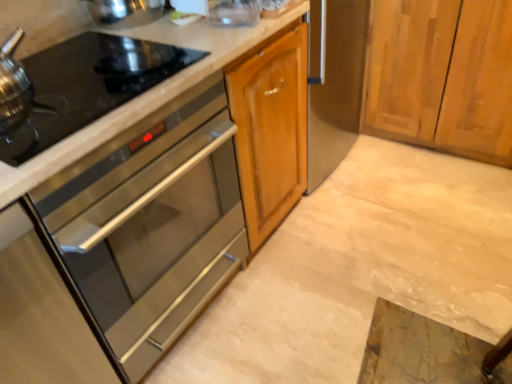
Describe the element at coordinates (131, 217) in the screenshot. This screenshot has height=384, width=512. I see `stainless steel oven at left` at that location.

What do you see at coordinates (360, 270) in the screenshot? I see `marble countertop at center` at bounding box center [360, 270].

You are a GUI agent. You are given a task and a screenshot of the screen. Output one action in this format:
    pyautogui.click(x=<x>, y=<y>)
    Task: Click on the stainless steel oven at left
    
    Given the screenshot: What is the action you would take?
    pyautogui.click(x=131, y=217)

Which is closer to the camera, [439,250] or [81,62]?

Positioned in front is point [81,62].

Considering the relative sizes of marble countertop at center and black glass gas stove at left in the image provided, is marble countertop at center shorter than black glass gas stove at left?

Correct, marble countertop at center is not as tall as black glass gas stove at left.

Is black glass gas stove at left at the back of marble countertop at center?

No, marble countertop at center is not facing the opposite direction of black glass gas stove at left.

Considering the positions of objects marble countertop at center and black glass gas stove at left in the image provided, who is more to the left, marble countertop at center or black glass gas stove at left?

black glass gas stove at left.

Consider the image. Is stainless steel oven at left oriented towards black glass gas stove at left?

No, stainless steel oven at left is not facing towards black glass gas stove at left.

From their relative heights in the image, would you say stainless steel oven at left is taller or shorter than black glass gas stove at left?

In the image, stainless steel oven at left appears to be taller than black glass gas stove at left.

At what (x,y) coordinates should I click in order to perform the action: click on gas stove that is on the left side of stainless steel oven at left. Please return your answer as a coordinate pair (x, y). Looking at the image, I should click on (85, 86).

Is stainless steel oven at left outside of black glass gas stove at left?

Yes.

From a real-world perspective, does stainless steel oven at left stand above marble countertop at center?

Yes, from a real-world perspective, stainless steel oven at left is on top of marble countertop at center.

From the image's perspective, is stainless steel oven at left over marble countertop at center?

Correct, stainless steel oven at left appears higher than marble countertop at center in the image.

Based on their positions, is stainless steel oven at left located to the left or right of marble countertop at center?

Based on their positions, stainless steel oven at left is located to the left of marble countertop at center.

Is stainless steel oven at left wider or thinner than marble countertop at center?

stainless steel oven at left is thinner than marble countertop at center.

Are marble countertop at center and stainless steel oven at left located far from each other?

That's not correct — marble countertop at center is a little close to stainless steel oven at left.

From the picture: From the image's perspective, is marble countertop at center above stainless steel oven at left?

No, from the image's perspective, marble countertop at center is not on top of stainless steel oven at left.

Consider the image. Could you tell me if marble countertop at center is turned towards stainless steel oven at left?

No, marble countertop at center is not turned towards stainless steel oven at left.

Between point (347, 331) and point (127, 113), which one is positioned in front?

The point (127, 113) is closer to the camera.

Considering the positions of points (55, 68) and (298, 6), is point (55, 68) farther from camera compared to point (298, 6)?

No, (55, 68) is closer to viewer.

Consider the image. In terms of width, does black glass gas stove at left look wider or thinner when compared to stainless steel oven at left?

Considering their sizes, black glass gas stove at left looks slimmer than stainless steel oven at left.

Does black glass gas stove at left appear on the right side of stainless steel oven at left?

No, black glass gas stove at left is not to the right of stainless steel oven at left.

Based on the photo, from a real-world perspective, is black glass gas stove at left over stainless steel oven at left?

Indeed, from a real-world perspective, black glass gas stove at left stands above stainless steel oven at left.

Is black glass gas stove at left touching marble countertop at center?

No.

Could you tell me if black glass gas stove at left is facing marble countertop at center?

No, black glass gas stove at left does not turn towards marble countertop at center.

From a real-world perspective, who is located higher, black glass gas stove at left or marble countertop at center?

black glass gas stove at left is physically above.

At what (x,y) coordinates should I click in order to perform the action: click on gas stove above the marble countertop at center (from the image's perspective). Please return your answer as a coordinate pair (x, y). The image size is (512, 384). Looking at the image, I should click on [x=85, y=86].

Locate an element on the screen. This screenshot has width=512, height=384. gas stove to the left of marble countertop at center is located at coordinates (85, 86).

Find the location of `cabinetry beneath the black glass gas stove at left (from a real-world perspective)`. cabinetry beneath the black glass gas stove at left (from a real-world perspective) is located at coordinates (131, 217).

From the image, which object appears to be farther from black glass gas stove at left, marble countertop at center or stainless steel oven at left?

marble countertop at center is positioned further to the anchor black glass gas stove at left.

Based on their spatial positions, is stainless steel oven at left or black glass gas stove at left closer to marble countertop at center?

Based on the image, stainless steel oven at left appears to be nearer to marble countertop at center.

Estimate the real-world distances between objects in this image. Which object is closer to marble countertop at center, black glass gas stove at left or stainless steel oven at left?

stainless steel oven at left.

Considering their positions, is black glass gas stove at left positioned closer to stainless steel oven at left than marble countertop at center?

black glass gas stove at left is positioned closer to the anchor stainless steel oven at left.

From the image, which object appears to be farther from stainless steel oven at left, marble countertop at center or black glass gas stove at left?

Based on the image, marble countertop at center appears to be further to stainless steel oven at left.

Considering their positions, is stainless steel oven at left positioned further to black glass gas stove at left than marble countertop at center?

marble countertop at center is positioned further to the anchor black glass gas stove at left.

Where is `cabinetry located between black glass gas stove at left and marble countertop at center in the left-right direction`? cabinetry located between black glass gas stove at left and marble countertop at center in the left-right direction is located at coordinates [131, 217].